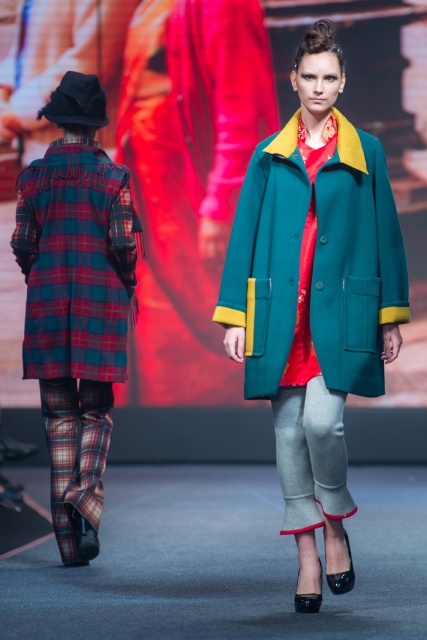
Question: Which is nearer to the plaid wool coat at left?

Choices:
 (A) red plaid coat at back
 (B) teal woolen coat at center

Answer: (A)

Question: Which object appears closest to the camera in this image?

Choices:
 (A) plaid wool coat at left
 (B) teal woolen coat at center

Answer: (B)

Question: Is plaid wool coat at left above red plaid coat at back?

Choices:
 (A) yes
 (B) no

Answer: (B)

Question: Which object is closer to the camera taking this photo?

Choices:
 (A) plaid wool coat at left
 (B) red plaid coat at back
 (C) teal woolen coat at center

Answer: (C)

Question: Does teal woolen coat at center appear on the left side of red plaid coat at back?

Choices:
 (A) no
 (B) yes

Answer: (A)

Question: Is plaid wool coat at left to the left of teal woolen coat at center from the viewer's perspective?

Choices:
 (A) yes
 (B) no

Answer: (A)